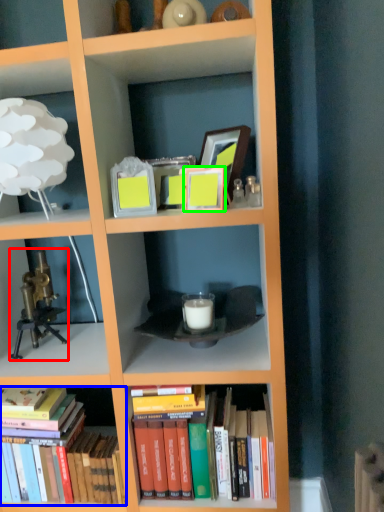
Question: Which is nearer to the toy (highlighted by a red box)? book (highlighted by a blue box) or picture frame (highlighted by a green box).

Choices:
 (A) book
 (B) picture frame

Answer: (A)